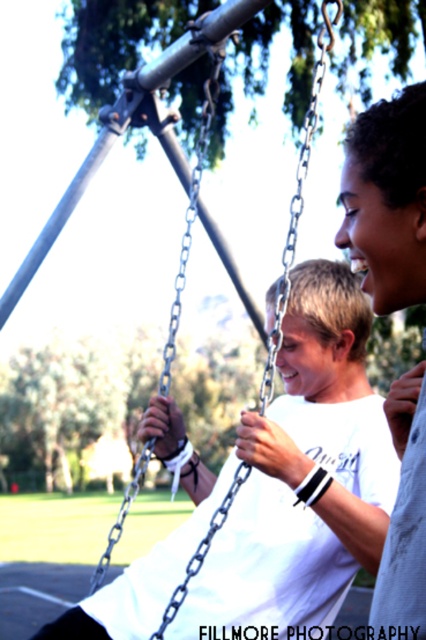
Question: Which object appears farthest from the camera in this image?

Choices:
 (A) metallic chain swing at center
 (B) white cotton shirt at center

Answer: (A)

Question: Which object is farther from the camera taking this photo?

Choices:
 (A) metallic chain swing at center
 (B) white cotton shirt at center

Answer: (A)

Question: Does white cotton shirt at center appear under metallic chain swing at center?

Choices:
 (A) no
 (B) yes

Answer: (A)

Question: Is white cotton shirt at center thinner than metallic chain swing at center?

Choices:
 (A) yes
 (B) no

Answer: (A)

Question: Is white cotton shirt at center bigger than metallic chain swing at center?

Choices:
 (A) no
 (B) yes

Answer: (A)

Question: Which point is farther to the camera?

Choices:
 (A) (377, 522)
 (B) (293, 253)

Answer: (B)